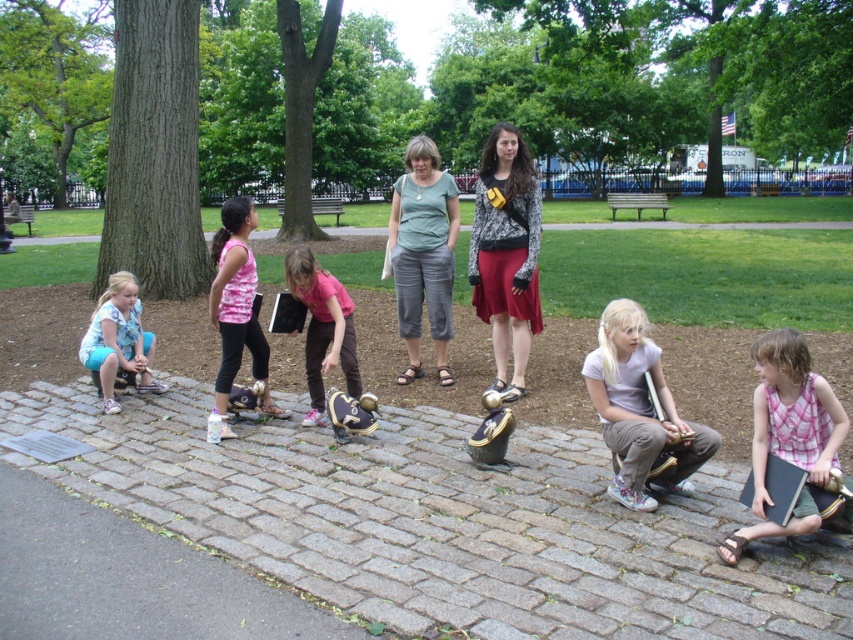
You are standing at the origin point of the image coordinate system. You want to walk to the gray cobblestone at center. Which direction should you move in terms of x and y coordinates?

The gray cobblestone at center is located at coordinates x 0.816 and y 0.519, so you should move in the positive x and positive y direction to reach it.

You are a person standing on the gray cobblestone at center and want to reach the light blue denim shorts at lower left. Which direction should you move to get there?

You should move to the lower left direction to reach the light blue denim shorts at lower left from the gray cobblestone at center.

You are standing at the camera position and want to pick up the ball closest to you. Which point, point (775,452) or point (312,308), is closer to your current position?

Point (775,452) is closer to the camera than point (312,308), so you should pick up the ball at point (775,452).